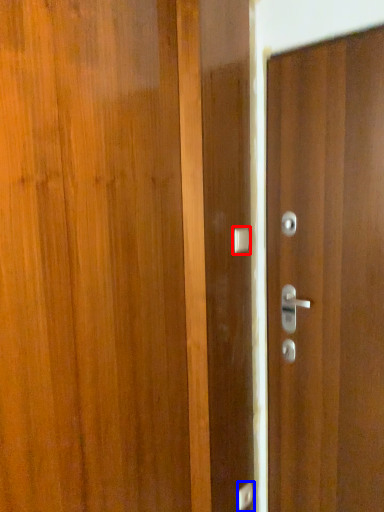
Question: Which point is closer to the camera, door handle (highlighted by a red box) or door handle (highlighted by a blue box)?

Choices:
 (A) door handle
 (B) door handle

Answer: (A)